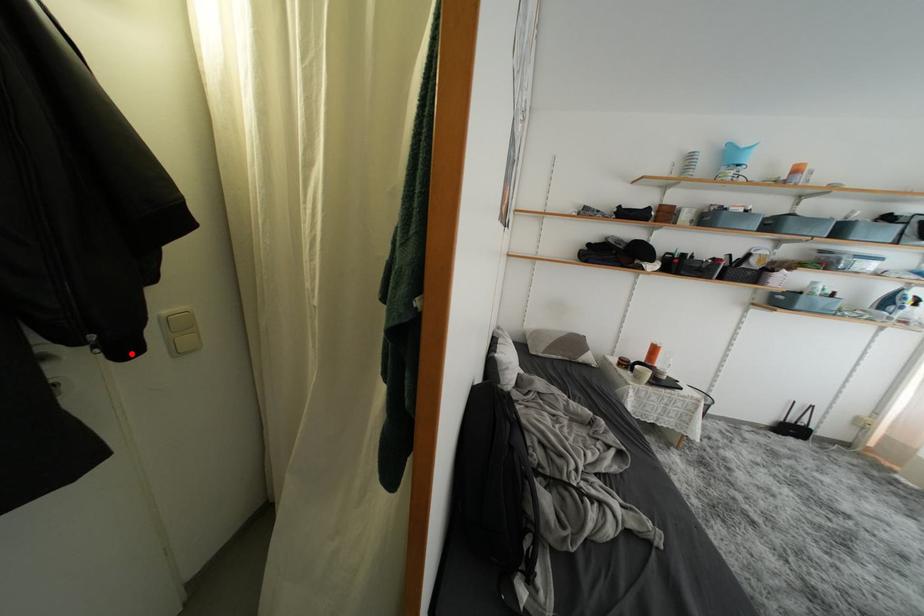
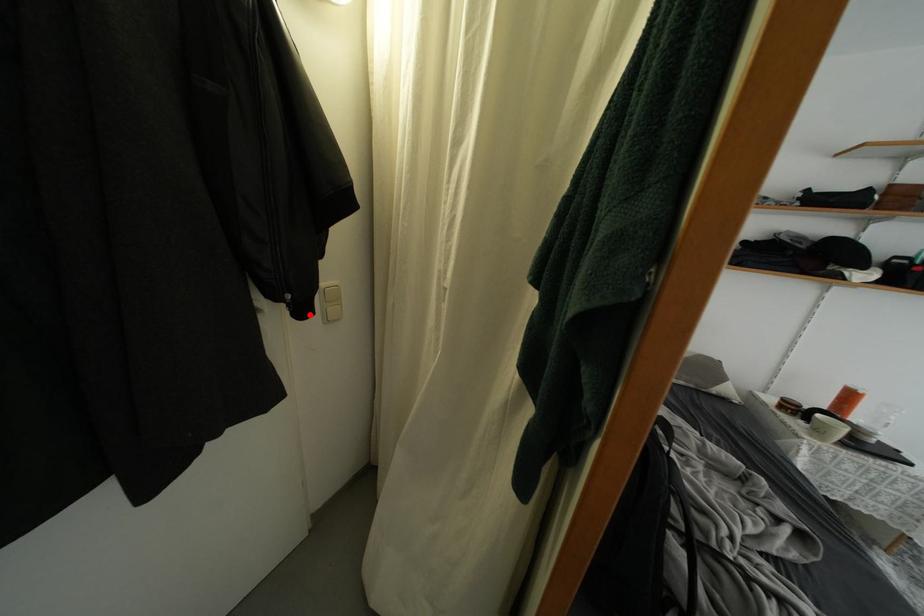
I am providing you with two images of the same scene from different viewpoints. A red point is marked on the first image and another point is marked on the second image. Is the marked point in image1 the same physical position as the marked point in image2?

Yes